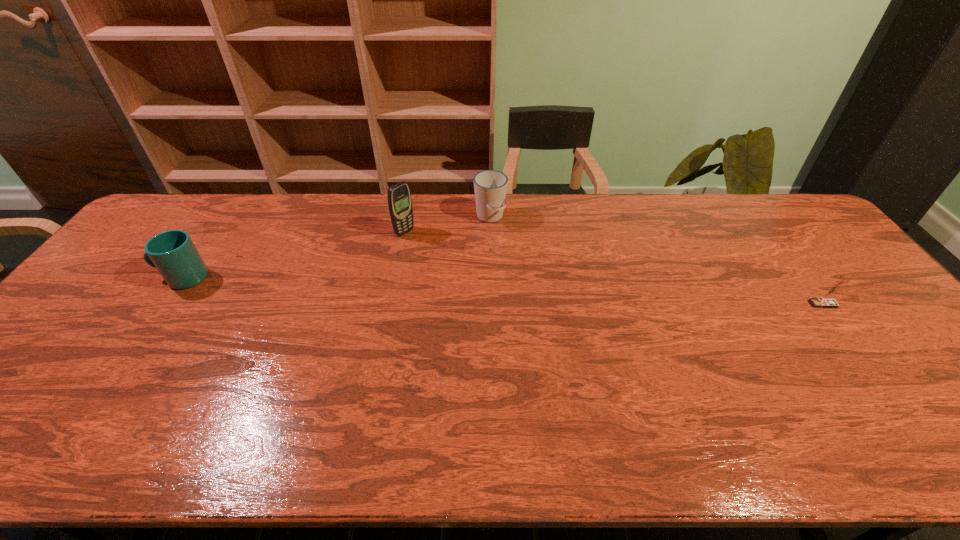
At what (x,y) coordinates should I click in order to perform the action: click on the leftmost object. Please return your answer as a coordinate pair (x, y). The width and height of the screenshot is (960, 540). Looking at the image, I should click on (173, 253).

What are the coordinates of `the second nearest object` in the screenshot? It's located at (173, 253).

The image size is (960, 540). I want to click on the rightmost object, so [x=829, y=302].

Locate an element on the screen. The height and width of the screenshot is (540, 960). matchbox is located at coordinates (829, 302).

The height and width of the screenshot is (540, 960). What are the coordinates of `the third object from right to left` in the screenshot? It's located at (399, 196).

The width and height of the screenshot is (960, 540). Find the location of `the tallest object`. the tallest object is located at coordinates (399, 196).

I want to click on the farther cup, so click(490, 186).

Locate an element on the screen. Image resolution: width=960 pixels, height=540 pixels. the right cup is located at coordinates (490, 186).

Locate an element on the screen. The height and width of the screenshot is (540, 960). free spot located on the handle side of the second nearest object is located at coordinates (117, 278).

Where is `free spot located 0.120m on the handle side of the second nearest object`? free spot located 0.120m on the handle side of the second nearest object is located at coordinates (117, 278).